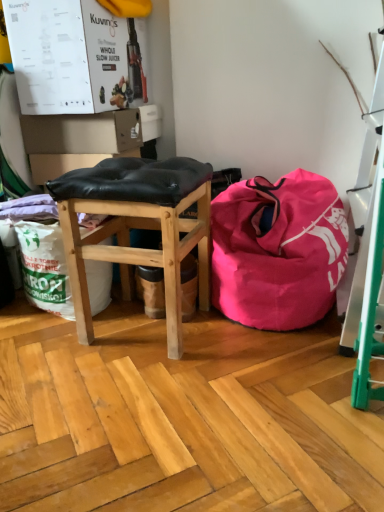
Describe the element at coordinates (278, 250) in the screenshot. I see `pink fabric bean bag at center` at that location.

What is the approximate width of pink fabric bean bag at center?

It is 20.43 inches.

You are a GUI agent. You are given a task and a screenshot of the screen. Output one action in this format:
    pyautogui.click(x=<x>, y=<y>)
    Task: Click on the pink fabric bean bag at center
    
    Given the screenshot: What is the action you would take?
    pyautogui.click(x=278, y=250)

This screenshot has height=512, width=384. Describe the element at coordinates (137, 228) in the screenshot. I see `black leather stool at center` at that location.

Locate an element on the screen. This screenshot has height=512, width=384. black leather stool at center is located at coordinates (137, 228).

Where is `pink fabric bean bag at center`? Image resolution: width=384 pixels, height=512 pixels. pink fabric bean bag at center is located at coordinates (278, 250).

Which is more to the right, pink fabric bean bag at center or black leather stool at center?

pink fabric bean bag at center.

Which object is closer to the camera, pink fabric bean bag at center or black leather stool at center?

black leather stool at center is in front.

Considering the positions of point (288, 211) and point (161, 227), is point (288, 211) closer or farther from the camera than point (161, 227)?

Point (288, 211).

From the image's perspective, is pink fabric bean bag at center on black leather stool at center?

Correct, pink fabric bean bag at center appears higher than black leather stool at center in the image.

From a real-world perspective, between pink fabric bean bag at center and black leather stool at center, who is vertically higher?

black leather stool at center.

Considering the relative sizes of pink fabric bean bag at center and black leather stool at center in the image provided, is pink fabric bean bag at center wider than black leather stool at center?

Yes, pink fabric bean bag at center is wider than black leather stool at center.

Between pink fabric bean bag at center and black leather stool at center, which one has less height?

pink fabric bean bag at center.

Is pink fabric bean bag at center bigger or smaller than black leather stool at center?

Clearly, pink fabric bean bag at center is larger in size than black leather stool at center.

Is pink fabric bean bag at center inside or outside of black leather stool at center?

pink fabric bean bag at center is not enclosed by black leather stool at center.

Are pink fabric bean bag at center and black leather stool at center located far from each other?

No.

Is pink fabric bean bag at center aimed at black leather stool at center?

No.

Where is `stool below the pink fabric bean bag at center (from the image's perspective)`? The height and width of the screenshot is (512, 384). stool below the pink fabric bean bag at center (from the image's perspective) is located at coordinates (137, 228).

Considering the relative positions of black leather stool at center and pink fabric bean bag at center in the image provided, is black leather stool at center to the left of pink fabric bean bag at center from the viewer's perspective?

Yes, black leather stool at center is to the left of pink fabric bean bag at center.

Which is in front, black leather stool at center or pink fabric bean bag at center?

black leather stool at center is in front.

Is point (159, 179) closer to camera compared to point (221, 283)?

Yes, it is in front of point (221, 283).

From the image's perspective, which one is positioned lower, black leather stool at center or pink fabric bean bag at center?

black leather stool at center is shown below in the image.

From a real-world perspective, is black leather stool at center over pink fabric bean bag at center?

Indeed, from a real-world perspective, black leather stool at center stands above pink fabric bean bag at center.

Which of these two, black leather stool at center or pink fabric bean bag at center, is thinner?

black leather stool at center.

Considering the sizes of objects black leather stool at center and pink fabric bean bag at center in the image provided, who is taller, black leather stool at center or pink fabric bean bag at center?

→ black leather stool at center is taller.

Is black leather stool at center bigger than pink fabric bean bag at center?

Actually, black leather stool at center might be smaller than pink fabric bean bag at center.

Would you say black leather stool at center contains pink fabric bean bag at center?

Actually, pink fabric bean bag at center is outside black leather stool at center.

Is black leather stool at center directly adjacent to pink fabric bean bag at center?

black leather stool at center and pink fabric bean bag at center are not in contact.

Could you tell me if black leather stool at center is turned towards pink fabric bean bag at center?

No, black leather stool at center is not facing towards pink fabric bean bag at center.

How many degrees apart are the facing directions of black leather stool at center and pink fabric bean bag at center?

There is a 0.272-degree angle between the facing directions of black leather stool at center and pink fabric bean bag at center.

Locate an element on the screen. The width and height of the screenshot is (384, 512). bean bag chair lying above the black leather stool at center (from the image's perspective) is located at coordinates (278, 250).

I want to click on bean bag chair that appears above the black leather stool at center (from the image's perspective), so click(x=278, y=250).

The height and width of the screenshot is (512, 384). I want to click on stool that appears in front of the pink fabric bean bag at center, so click(x=137, y=228).